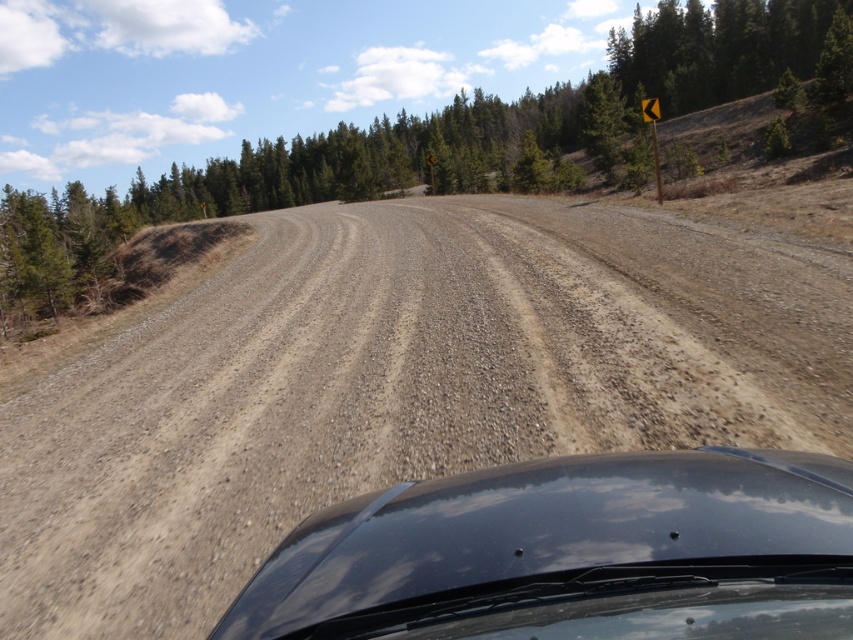
You are driving a car and looking out the window. You see two points on the road ahead. The first point is at coordinate point [434,209] and the second is at point [495,467]. Which point is closer to your current position?

Point [495,467] is closer to your current position because it is in front of point [434,209], which is further away.

You are driving a glossy black car at center and want to park it on the dusty gravel road at center. Can you determine if the road is wide enough for your car?

The dusty gravel road at center might be wider than glossy black car at center, so there is a possibility that the road is wide enough for the car to park.